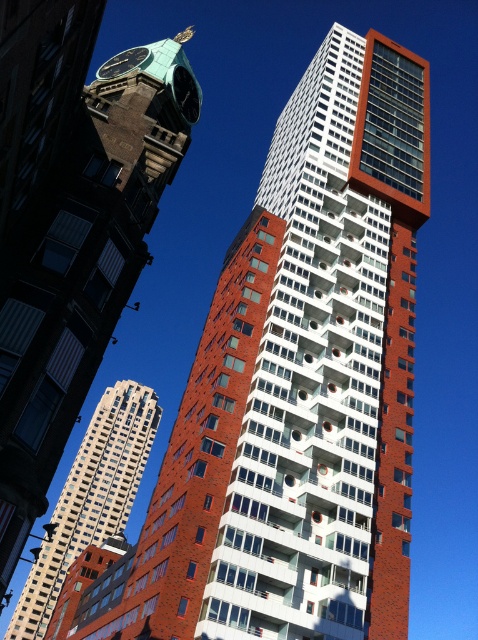
You are an architect analyzing the urban layout. You observe the green patina clock tower at upper left and the matte white tower at center. Which of these two towers has a greater horizontal span when viewed from your current position?

The green patina clock tower at upper left has a greater horizontal span than the matte white tower at center because its width is larger according to the description.

You are a photographer standing in the middle of the street. You want to capture both the brick textured building at center and the green polished stone clock at upper left in the same frame. Based on their positions, which one should you pan your camera towards first to include both in your shot?

Since the brick textured building at center is to the left of the green polished stone clock at upper left, you should pan your camera towards the green polished stone clock at upper left first to ensure both are in the frame.

Based on the photo, you are standing in the middle of the urban scene and want to take a photo of the green patina clock tower at upper left. Which direction should you face to capture it in your camera view?

You should face towards the upper left direction to capture the green patina clock tower at upper left, as it is located at point coordinates of (83, 272).